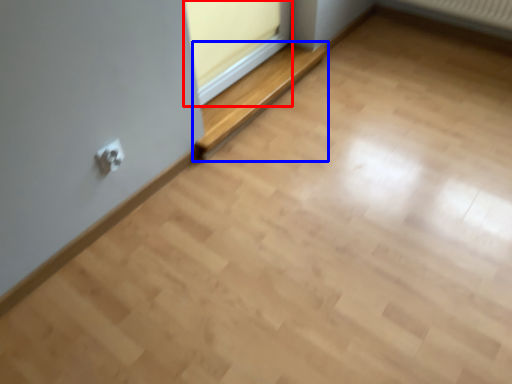
Question: Among these objects, which one is nearest to the camera, window frame (highlighted by a red box) or balustrade (highlighted by a blue box)?

Choices:
 (A) window frame
 (B) balustrade

Answer: (A)